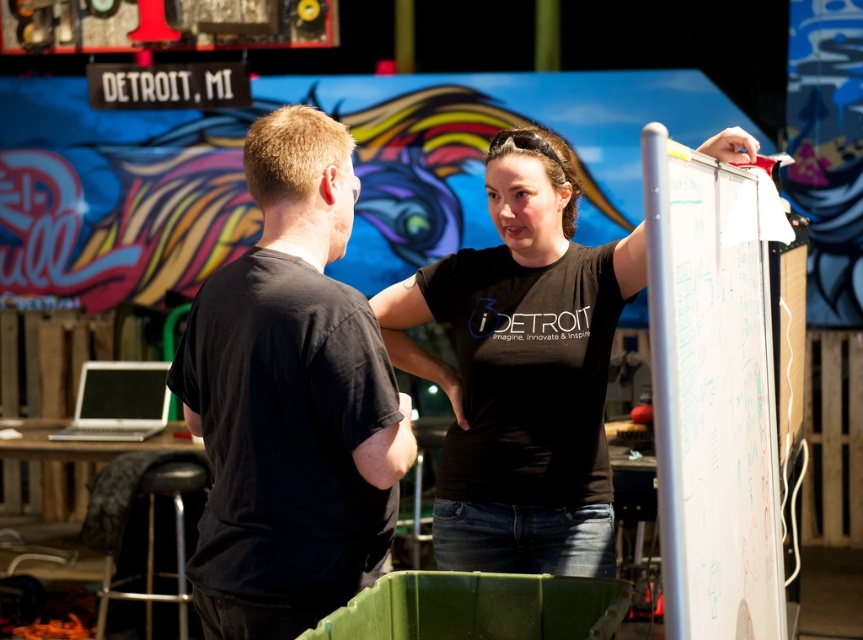
In the scene shown: Can you confirm if black matte t-shirt at center is bigger than black leather stool at lower left?

Incorrect, black matte t-shirt at center is not larger than black leather stool at lower left.

Who is positioned more to the left, black matte t-shirt at center or black leather stool at lower left?

From the viewer's perspective, black leather stool at lower left appears more on the left side.

The width and height of the screenshot is (863, 640). What are the coordinates of `black matte t-shirt at center` in the screenshot? It's located at (521, 371).

Find the location of a particular element. black matte t-shirt at center is located at coordinates (521, 371).

Measure the distance between point (230, 584) and camera.

Point (230, 584) and camera are 2.36 meters apart.

Does black matte t-shirt at left have a smaller size compared to black matte t-shirt at center?

Yes, black matte t-shirt at left is smaller than black matte t-shirt at center.

Between point (252, 467) and point (433, 552), which one is positioned in front?

Point (252, 467)

What are the coordinates of `black matte t-shirt at left` in the screenshot? It's located at (290, 401).

Between black matte t-shirt at left and black leather stool at lower left, which one is positioned higher?

black matte t-shirt at left is above.

Who is lower down, black matte t-shirt at left or black leather stool at lower left?

Positioned lower is black leather stool at lower left.

This screenshot has height=640, width=863. What do you see at coordinates (290, 401) in the screenshot? I see `black matte t-shirt at left` at bounding box center [290, 401].

The height and width of the screenshot is (640, 863). I want to click on black matte t-shirt at left, so click(x=290, y=401).